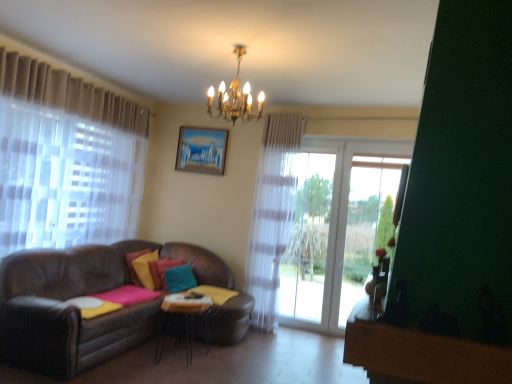
Locate an element on the screen. The width and height of the screenshot is (512, 384). vacant space situated above gold metallic chandelier at upper center (from a real-world perspective) is located at coordinates (244, 50).